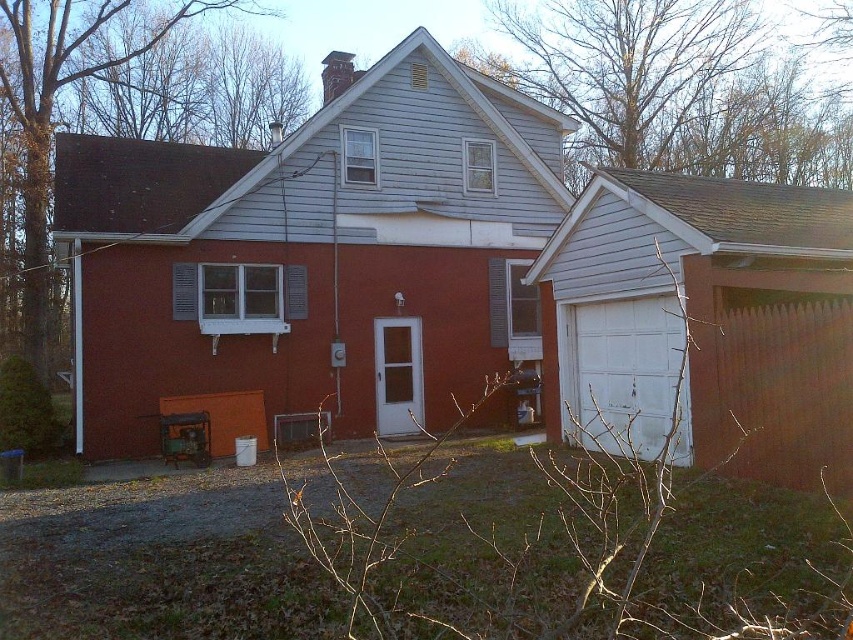
Question: Which point is farther to the camera?

Choices:
 (A) (103, 401)
 (B) (782, 269)

Answer: (A)

Question: Does smooth red shed at center have a lesser width compared to white matte garage door at right?

Choices:
 (A) no
 (B) yes

Answer: (A)

Question: Is smooth red shed at center above white matte garage door at right?

Choices:
 (A) yes
 (B) no

Answer: (A)

Question: Can you confirm if smooth red shed at center is smaller than white matte garage door at right?

Choices:
 (A) yes
 (B) no

Answer: (B)

Question: Which of the following is the closest to the observer?

Choices:
 (A) white matte garage door at right
 (B) smooth red shed at center

Answer: (A)

Question: Which point appears closest to the camera in this image?

Choices:
 (A) (335, 58)
 (B) (614, 170)

Answer: (B)